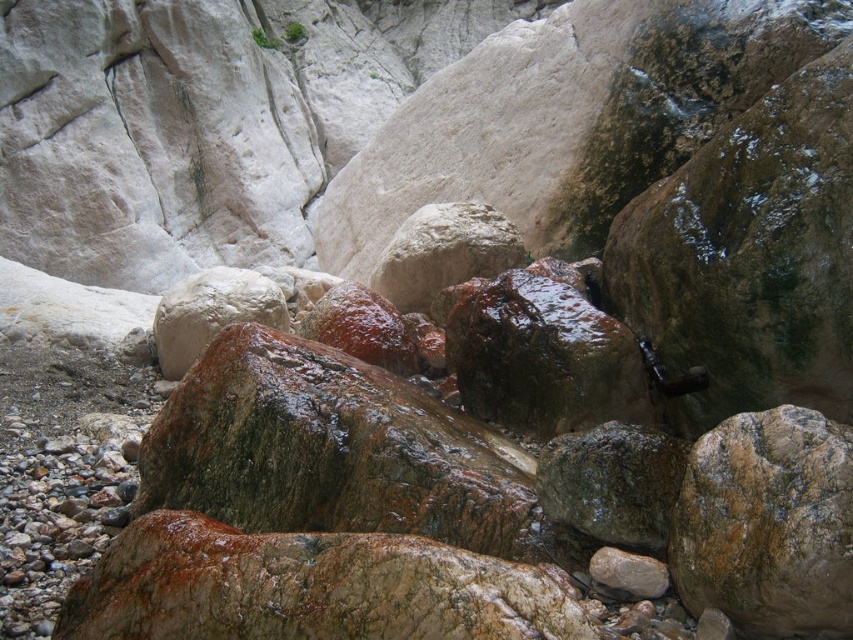
Question: Does brown rough rock at center lie in front of rusty metallic rock at center?

Choices:
 (A) no
 (B) yes

Answer: (B)

Question: Among these points, which one is nearest to the camera?

Choices:
 (A) (281, 301)
 (B) (738, 524)

Answer: (B)

Question: Which point is closer to the camera taking this photo?

Choices:
 (A) (694, 509)
 (B) (248, 316)

Answer: (A)

Question: Which point is closer to the camera?

Choices:
 (A) (173, 378)
 (B) (670, 570)

Answer: (B)

Question: Does brown rough rock at center lie behind rusty metallic rock at center?

Choices:
 (A) no
 (B) yes

Answer: (A)

Question: Does brown rough rock at center have a smaller size compared to rusty metallic rock at center?

Choices:
 (A) yes
 (B) no

Answer: (A)